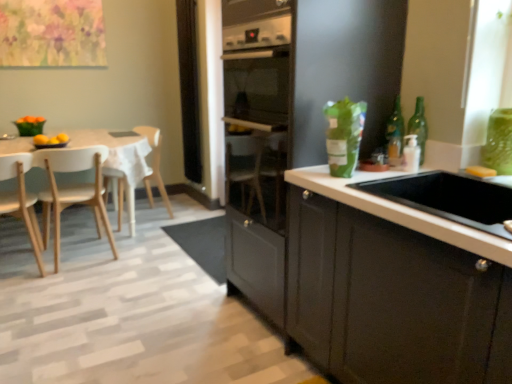
Question: Is white wood table at left positioned behind wooden chair at left, the 1th chair from the back?

Choices:
 (A) yes
 (B) no

Answer: (B)

Question: From a real-world perspective, is white wood table at left positioned over wooden chair at left, the 1th chair from the back, based on gravity?

Choices:
 (A) no
 (B) yes

Answer: (A)

Question: Does white wood table at left appear on the right side of wooden chair at left, the 1th chair from the back?

Choices:
 (A) no
 (B) yes

Answer: (A)

Question: Is white wood table at left oriented towards wooden chair at left, the 3th chair viewed from the front?

Choices:
 (A) yes
 (B) no

Answer: (B)

Question: Would you say wooden chair at left, the 1th chair from the back, is part of white wood table at left's contents?

Choices:
 (A) no
 (B) yes

Answer: (B)

Question: From a real-world perspective, is green glass bottle at upper right, positioned as the 1th bottle in left-to-right order, physically located above or below white glossy sink at center right?

Choices:
 (A) below
 (B) above

Answer: (B)

Question: Based on their sizes in the image, would you say green glass bottle at upper right, placed as the 2th bottle when sorted from right to left, is bigger or smaller than white glossy sink at center right?

Choices:
 (A) big
 (B) small

Answer: (B)

Question: From their relative heights in the image, would you say green glass bottle at upper right, placed as the 2th bottle when sorted from right to left, is taller or shorter than white glossy sink at center right?

Choices:
 (A) tall
 (B) short

Answer: (A)

Question: Is green glass bottle at upper right, positioned as the 1th bottle in left-to-right order, spatially inside white glossy sink at center right, or outside of it?

Choices:
 (A) inside
 (B) outside

Answer: (B)

Question: Based on their sizes in the image, would you say white glossy sink at center right is bigger or smaller than light wood chair at left, which is the third chair in back-to-front order?

Choices:
 (A) big
 (B) small

Answer: (B)

Question: From the image's perspective, relative to light wood chair at left, arranged as the 1th chair when viewed from the front, is white glossy sink at center right above or below?

Choices:
 (A) above
 (B) below

Answer: (A)

Question: From a real-world perspective, is white glossy sink at center right physically located above or below light wood chair at left, which is the third chair in back-to-front order?

Choices:
 (A) above
 (B) below

Answer: (A)

Question: Is white glossy sink at center right taller or shorter than light wood chair at left, arranged as the 1th chair when viewed from the front?

Choices:
 (A) short
 (B) tall

Answer: (A)

Question: Considering the positions of black mesh screen at center and white wood table at left in the image, is black mesh screen at center wider or thinner than white wood table at left?

Choices:
 (A) wide
 (B) thin

Answer: (B)

Question: Considering their positions, is black mesh screen at center located in front of or behind white wood table at left?

Choices:
 (A) behind
 (B) front

Answer: (A)